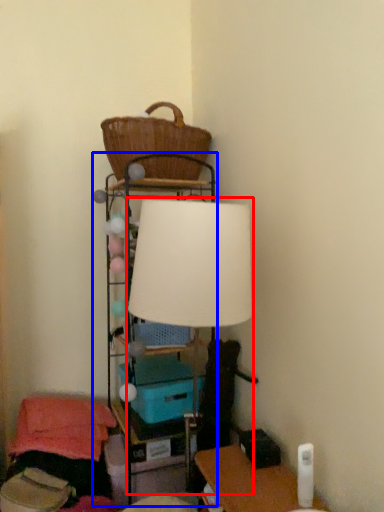
Question: Among these objects, which one is nearest to the camera, lamp (highlighted by a red box) or shelf (highlighted by a blue box)?

Choices:
 (A) lamp
 (B) shelf

Answer: (A)